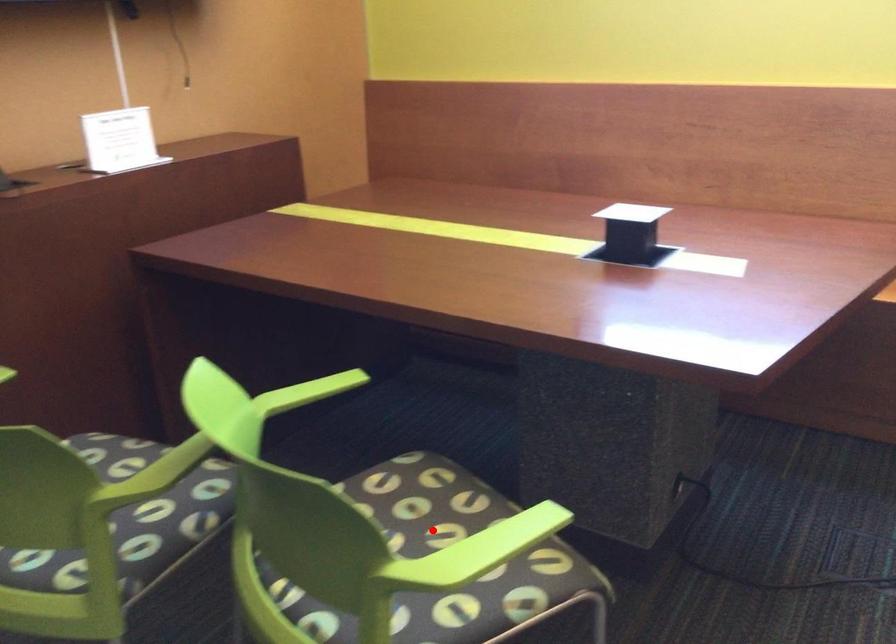
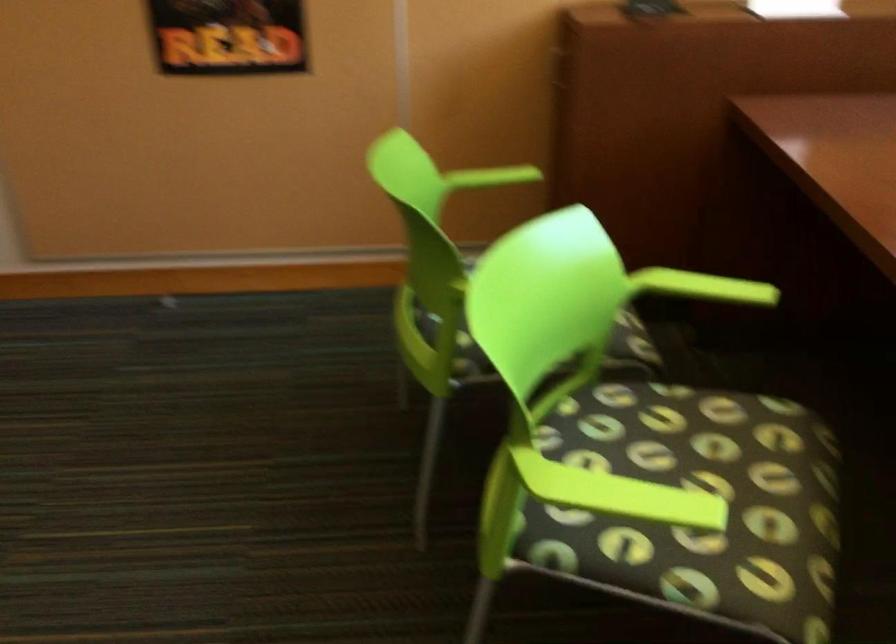
Question: I am providing you with two images of the same scene from different viewpoints. A red point is shown in image1. For the corresponding object point in image2, is it positioned nearer or farther from the camera?

Choices:
 (A) Nearer
 (B) Farther

Answer: (A)